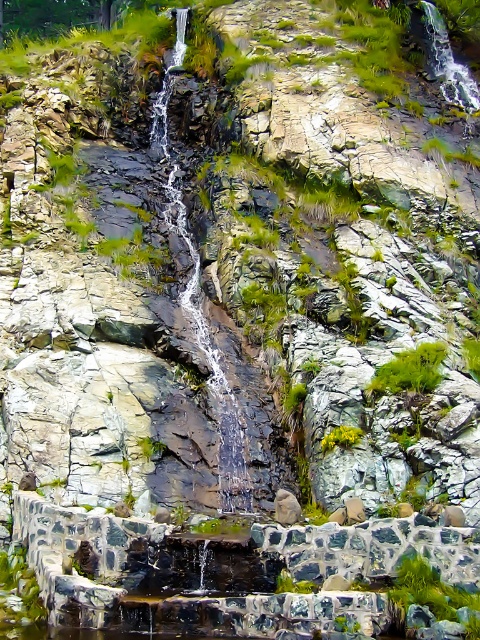
Question: Among these objects, which one is nearest to the camera?

Choices:
 (A) green leafy plant at center
 (B) clear water at center

Answer: (B)

Question: Considering the relative positions of clear water at center and green leafy plant at center in the image provided, where is clear water at center located with respect to green leafy plant at center?

Choices:
 (A) right
 (B) left

Answer: (B)

Question: Can you confirm if clear water at center is positioned to the right of green leafy plant at center?

Choices:
 (A) yes
 (B) no

Answer: (B)

Question: Does clear water at center have a lesser width compared to green leafy plant at center?

Choices:
 (A) no
 (B) yes

Answer: (A)